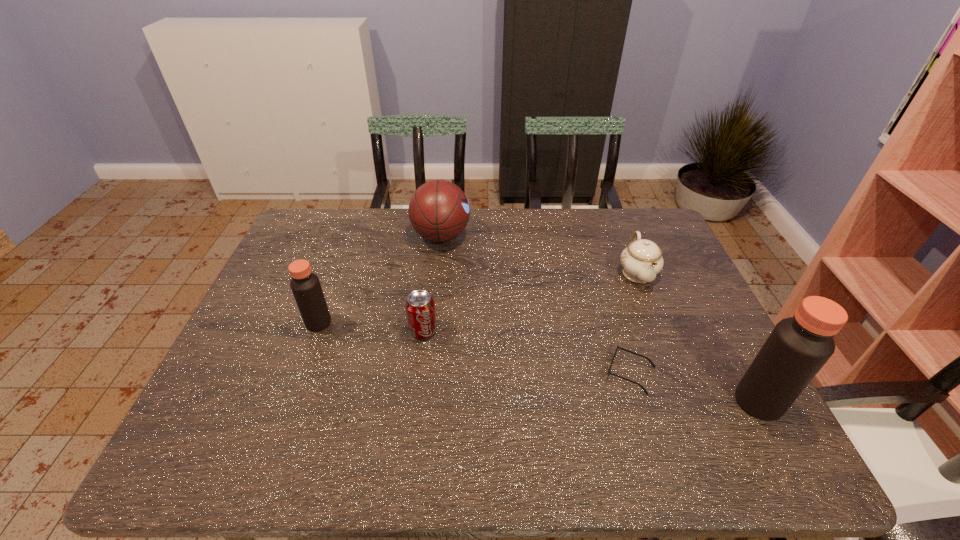
The height and width of the screenshot is (540, 960). What are the coordinates of `the leftmost object` in the screenshot? It's located at (305, 285).

You are a GUI agent. You are given a task and a screenshot of the screen. Output one action in this format:
    pyautogui.click(x=<x>, y=<y>)
    Task: Click on the farther vinegar
    This screenshot has height=540, width=960.
    Given the screenshot: What is the action you would take?
    pyautogui.click(x=305, y=285)

This screenshot has width=960, height=540. Find the location of `the right vinegar`. the right vinegar is located at coordinates (798, 347).

The height and width of the screenshot is (540, 960). Identify the location of the rightmost object. (798, 347).

I want to click on basketball, so click(x=439, y=211).

Locate an element on the screen. The height and width of the screenshot is (540, 960). the shortest object is located at coordinates coord(617,347).

At what (x,y) coordinates should I click in order to perform the action: click on chinaware. Please return your answer as a coordinate pair (x, y). Looking at the image, I should click on (641, 261).

The image size is (960, 540). In order to click on soda can in this screenshot , I will do `click(420, 307)`.

You are a GUI agent. You are given a task and a screenshot of the screen. Output one action in this format:
    pyautogui.click(x=<x>, y=<y>)
    Task: Click on the vacant space located 0.180m on the front of the farther vinegar
    The height and width of the screenshot is (540, 960).
    Given the screenshot: What is the action you would take?
    pyautogui.click(x=294, y=392)

The image size is (960, 540). Find the location of `vacant region located on the back of the nearer vinegar`. vacant region located on the back of the nearer vinegar is located at coordinates (729, 346).